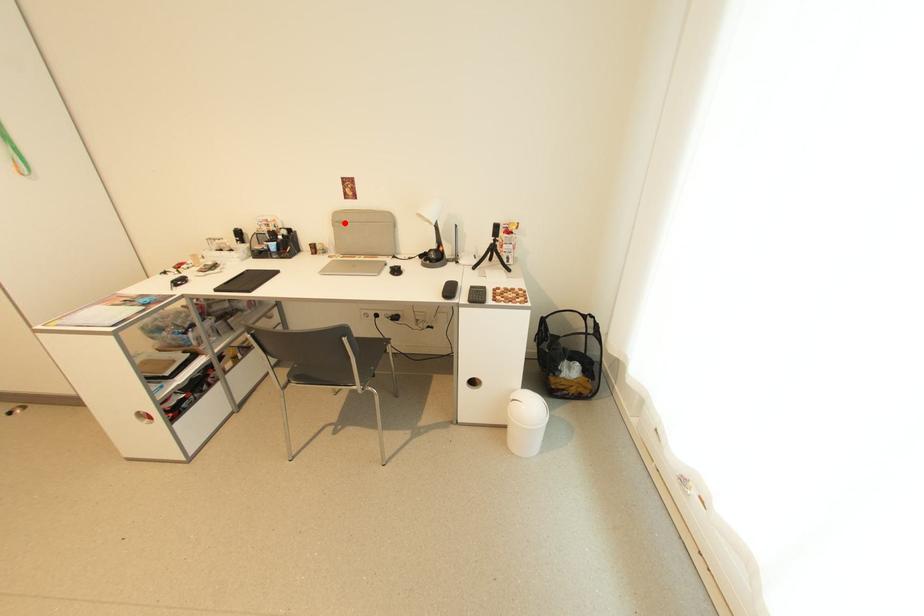
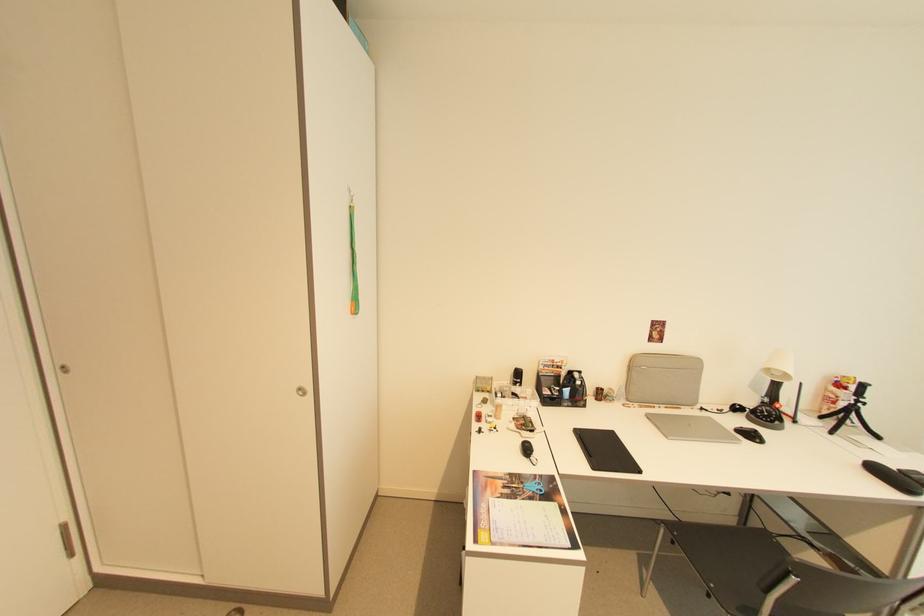
Locate, in the second image, the point that corresponds to the highlighted location in the first image.

(638, 366)